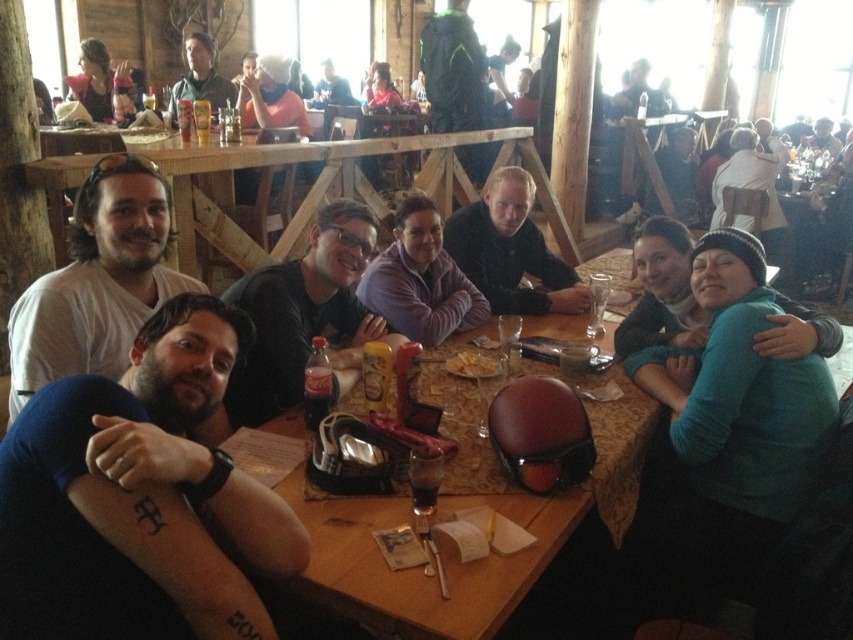
Question: Which point is closer to the camera?

Choices:
 (A) (461, 259)
 (B) (242, 298)

Answer: (B)

Question: Is purple sweater at center bigger than matte black jacket at upper center?

Choices:
 (A) no
 (B) yes

Answer: (A)

Question: Is dark brown leather jacket at center to the left of yellow crispy chips at center from the viewer's perspective?

Choices:
 (A) no
 (B) yes

Answer: (A)

Question: Which object appears farthest from the camera in this image?

Choices:
 (A) white knit hat at upper center
 (B) purple sweater at center
 (C) dark brown leather jacket at center

Answer: (A)

Question: Does dark blue shirt at center appear on the right side of purple sweater at center?

Choices:
 (A) yes
 (B) no

Answer: (B)

Question: Which of these objects is positioned farthest from the matte black jacket at upper right?

Choices:
 (A) dark blue shirt at center
 (B) matte black jacket at upper center

Answer: (A)